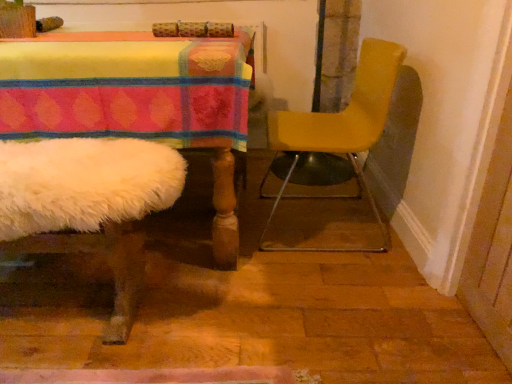
At what (x,y) coordinates should I click in order to perform the action: click on vacant space behind yellow leather chair at right. Please return your answer as a coordinate pair (x, y). The width and height of the screenshot is (512, 384). Looking at the image, I should click on (x=294, y=187).